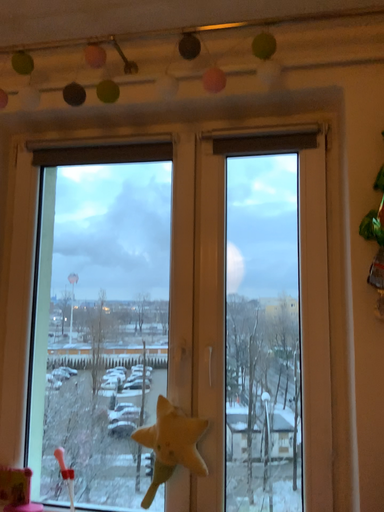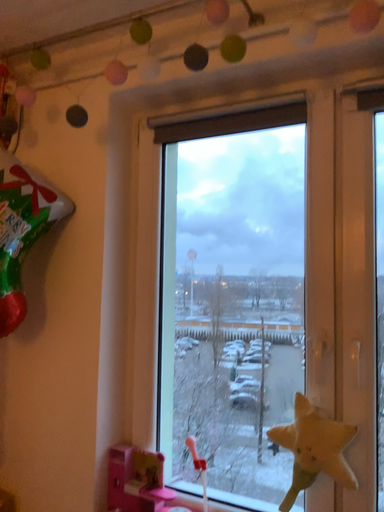
Question: Which way did the camera rotate in the video?

Choices:
 (A) rotated left
 (B) rotated right

Answer: (A)